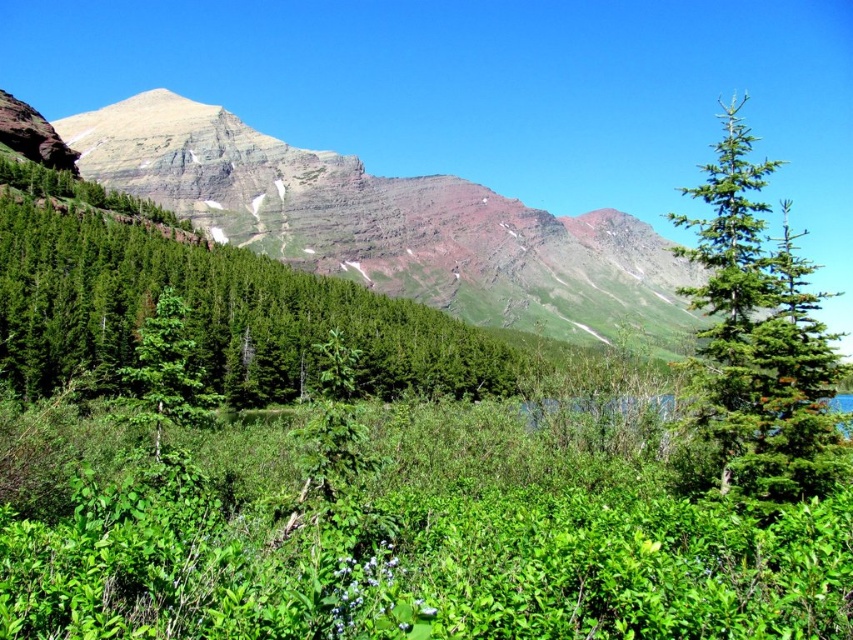
You are a hiker standing at the base of the green grassy mountain at upper center and want to reach the green matte tree at center. Given that your average hiking pace is 3 miles per hour, how long would it take you to walk directly to the tree?

The distance between the green grassy mountain at upper center and the green matte tree at center is 329.36 feet. Converting this to miles, 329.36 feet is approximately 0.0623 miles. At a pace of 3 miles per hour, the time required would be distance divided by speed, so 0.0623 miles divided by 3 mph equals approximately 0.0208 hours. Converting hours to minutes by multiplying by 60, this results in roughly 1.25 minutes. Therefore, it would take about 1 and a quarter minutes to walk directly to the green mat

Based on the scene description, where is the green grassy mountain located in relation to the point marked at coordinates (393,227)?

The green grassy mountain at upper center is exactly at the point marked by coordinates (393,227).